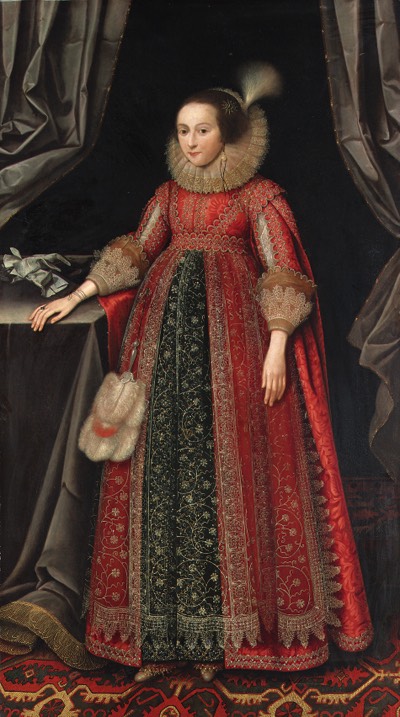
Locate an element on the screen. This screenshot has width=400, height=717. black wall/background is located at coordinates (311, 120).